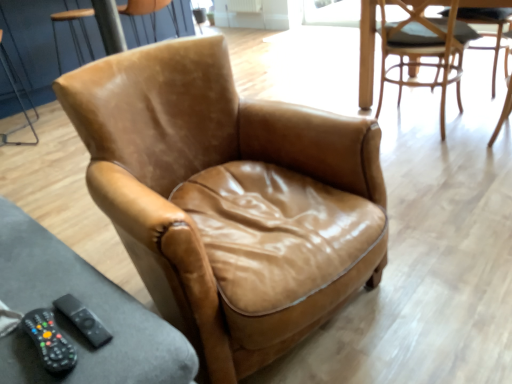
Locate an element on the screen. The image size is (512, 384). light brown leather chair at upper right, which ranks as the 1th chair in right-to-left order is located at coordinates (424, 48).

I want to click on black plastic remote at lower left, so click(x=84, y=320).

Measure the distance between point (31, 320) and camera.

The depth of point (31, 320) is 29.21 inches.

Image resolution: width=512 pixels, height=384 pixels. I want to click on leather armchair at center, the 3th chair in the back-to-front sequence, so tap(221, 194).

Does point (53, 368) come closer to viewer compared to point (151, 10)?

Yes, point (53, 368) is closer to viewer.

Are black rubber remote control at lower left and brown leather armchair at upper left, which is counted as the 3th chair, starting from the front, far apart?

Absolutely, black rubber remote control at lower left is distant from brown leather armchair at upper left, which is counted as the 3th chair, starting from the front.

Between black rubber remote control at lower left and brown leather armchair at upper left, the 1th chair when ordered from back to front, which one is positioned behind?

brown leather armchair at upper left, the 1th chair when ordered from back to front, is further away from the camera.

Which object is wider, black rubber remote control at lower left or brown leather armchair at upper left, marked as the first chair in a left-to-right arrangement?

With larger width is brown leather armchair at upper left, marked as the first chair in a left-to-right arrangement.

Find the location of a particular element. This screenshot has width=512, height=384. remote that is on the right side of brown leather armchair at upper left, marked as the first chair in a left-to-right arrangement is located at coordinates (84, 320).

Considering the sizes of objects black plastic remote at lower left and brown leather armchair at upper left, which is counted as the 3th chair, starting from the front, in the image provided, who is smaller, black plastic remote at lower left or brown leather armchair at upper left, which is counted as the 3th chair, starting from the front,?

With smaller size is black plastic remote at lower left.

In the scene shown: In the image, is black plastic remote at lower left positioned in front of or behind brown leather armchair at upper left, the 1th chair when ordered from back to front?

In the image, black plastic remote at lower left appears in front of brown leather armchair at upper left, the 1th chair when ordered from back to front.

Which is correct: black plastic remote at lower left is inside brown leather armchair at upper left, which is counted as the third chair, starting from the right, or outside of it?

black plastic remote at lower left is outside brown leather armchair at upper left, which is counted as the third chair, starting from the right.

Does brown leather armchair at upper left, which is counted as the third chair, starting from the right, have a lesser height compared to black plastic remote at lower left?

No, brown leather armchair at upper left, which is counted as the third chair, starting from the right, is not shorter than black plastic remote at lower left.

Considering the positions of points (57, 42) and (81, 307), is point (57, 42) farther from camera compared to point (81, 307)?

Yes, point (57, 42) is farther from viewer.

Which object is further away from the camera taking this photo, brown leather armchair at upper left, marked as the first chair in a left-to-right arrangement, or black plastic remote at lower left?

brown leather armchair at upper left, marked as the first chair in a left-to-right arrangement.

How different are the orientations of brown leather armchair at upper left, which is counted as the 3th chair, starting from the front, and black plastic remote at lower left in degrees?

The angular difference between brown leather armchair at upper left, which is counted as the 3th chair, starting from the front, and black plastic remote at lower left is 179 degrees.

From the image's perspective, which object appears higher, black plastic remote at lower left or black rubber remote control at lower left?

black plastic remote at lower left appears higher in the image.

Is black plastic remote at lower left looking in the opposite direction of black rubber remote control at lower left?

No, black plastic remote at lower left is not facing away from black rubber remote control at lower left.

Which of these two, black plastic remote at lower left or black rubber remote control at lower left, is wider?

With larger width is black rubber remote control at lower left.

Is point (106, 332) closer or farther from the camera than point (55, 358)?

Point (106, 332).

From a real-world perspective, does leather armchair at center, which is the second chair in right-to-left order, stand above black rubber remote control at lower left?

Incorrect, from a real-world perspective, leather armchair at center, which is the second chair in right-to-left order, is lower than black rubber remote control at lower left.

Which of these two, leather armchair at center, which is the second chair in right-to-left order, or black rubber remote control at lower left, stands shorter?

black rubber remote control at lower left is shorter.

Which is further, (298, 168) or (82, 309)?

The point (298, 168) is farther.

Does point (53, 366) come behind point (384, 71)?

No, it is in front of (384, 71).

Is black rubber remote control at lower left facing towards light brown leather chair at upper right, acting as the 2th chair starting from the front?

No, black rubber remote control at lower left does not turn towards light brown leather chair at upper right, acting as the 2th chair starting from the front.

Considering the relative positions of black rubber remote control at lower left and light brown leather chair at upper right, acting as the 2th chair starting from the front, in the image provided, is black rubber remote control at lower left to the left of light brown leather chair at upper right, acting as the 2th chair starting from the front, from the viewer's perspective?

Correct, you'll find black rubber remote control at lower left to the left of light brown leather chair at upper right, acting as the 2th chair starting from the front.

From a real-world perspective, which is physically above, black rubber remote control at lower left or light brown leather chair at upper right, the third chair in the left-to-right sequence?

From a 3D spatial view, black rubber remote control at lower left is above.

Relative to leather armchair at center, the 3th chair in the back-to-front sequence, is black plastic remote at lower left in front or behind?

black plastic remote at lower left is positioned farther from the viewer than leather armchair at center, the 3th chair in the back-to-front sequence.

What's the angular difference between black plastic remote at lower left and leather armchair at center, which is the first chair from front to back,'s facing directions?

10.3 degrees separate the facing orientations of black plastic remote at lower left and leather armchair at center, which is the first chair from front to back.

Which of these two, black plastic remote at lower left or leather armchair at center, which is the first chair from front to back, stands shorter?

Standing shorter between the two is black plastic remote at lower left.

Measure the distance from black plastic remote at lower left to leather armchair at center, which is the first chair from front to back.

black plastic remote at lower left is 22.17 inches from leather armchair at center, which is the first chair from front to back.

Identify the location of chair lying on the left of black rubber remote control at lower left. Image resolution: width=512 pixels, height=384 pixels. (147, 13).

Locate an element on the screen. The width and height of the screenshot is (512, 384). remote located underneath the brown leather armchair at upper left, which is counted as the third chair, starting from the right (from a real-world perspective) is located at coordinates (84, 320).

When comparing their distances from black rubber remote control at lower left, does brown leather armchair at upper left, which is counted as the 3th chair, starting from the front, or black plastic remote at lower left seem closer?

black plastic remote at lower left is closer to black rubber remote control at lower left.

Looking at the image, which one is located further to light brown leather chair at upper right, the third chair in the left-to-right sequence, black rubber remote control at lower left or brown leather armchair at upper left, which is counted as the third chair, starting from the right?

Among the two, black rubber remote control at lower left is located further to light brown leather chair at upper right, the third chair in the left-to-right sequence.

Looking at the image, which one is located closer to brown leather armchair at upper left, marked as the first chair in a left-to-right arrangement, black plastic remote at lower left or light brown leather chair at upper right, which ranks as the 1th chair in right-to-left order?

Among the two, light brown leather chair at upper right, which ranks as the 1th chair in right-to-left order, is located nearer to brown leather armchair at upper left, marked as the first chair in a left-to-right arrangement.

When comparing their distances from light brown leather chair at upper right, the third chair in the left-to-right sequence, does brown leather armchair at upper left, which is counted as the 3th chair, starting from the front, or leather armchair at center, which is the first chair from front to back, seem further?

brown leather armchair at upper left, which is counted as the 3th chair, starting from the front.

Estimate the real-world distances between objects in this image. Which object is further from black plastic remote at lower left, black rubber remote control at lower left or leather armchair at center, positioned as the second chair in left-to-right order?

leather armchair at center, positioned as the second chair in left-to-right order, is positioned further to the anchor black plastic remote at lower left.

Based on their spatial positions, is black plastic remote at lower left or brown leather armchair at upper left, the 1th chair when ordered from back to front, closer to light brown leather chair at upper right, acting as the 2th chair starting from the front?

brown leather armchair at upper left, the 1th chair when ordered from back to front.

From the image, which object appears to be farther from leather armchair at center, which is the second chair in right-to-left order, black rubber remote control at lower left or light brown leather chair at upper right, which is the second chair in back-to-front order?

The object further to leather armchair at center, which is the second chair in right-to-left order, is light brown leather chair at upper right, which is the second chair in back-to-front order.

In the scene shown: Estimate the real-world distances between objects in this image. Which object is closer to leather armchair at center, which is the second chair in right-to-left order, light brown leather chair at upper right, which ranks as the 1th chair in right-to-left order, or black rubber remote control at lower left?

Among the two, black rubber remote control at lower left is located nearer to leather armchair at center, which is the second chair in right-to-left order.

The width and height of the screenshot is (512, 384). What are the coordinates of `remote between black rubber remote control at lower left and leather armchair at center, the 3th chair in the back-to-front sequence, from left to right` in the screenshot? It's located at (84, 320).

This screenshot has height=384, width=512. Find the location of `game controller positioned between leather armchair at center, which is the second chair in right-to-left order, and brown leather armchair at upper left, which is counted as the 3th chair, starting from the front, from near to far`. game controller positioned between leather armchair at center, which is the second chair in right-to-left order, and brown leather armchair at upper left, which is counted as the 3th chair, starting from the front, from near to far is located at coordinates (50, 341).

The width and height of the screenshot is (512, 384). Identify the location of game controller between brown leather armchair at upper left, the 1th chair when ordered from back to front, and light brown leather chair at upper right, acting as the 2th chair starting from the front, in the horizontal direction. (50, 341).

The width and height of the screenshot is (512, 384). In order to click on game controller between leather armchair at center, which is the second chair in right-to-left order, and light brown leather chair at upper right, which is the second chair in back-to-front order, from front to back in this screenshot , I will do `click(50, 341)`.